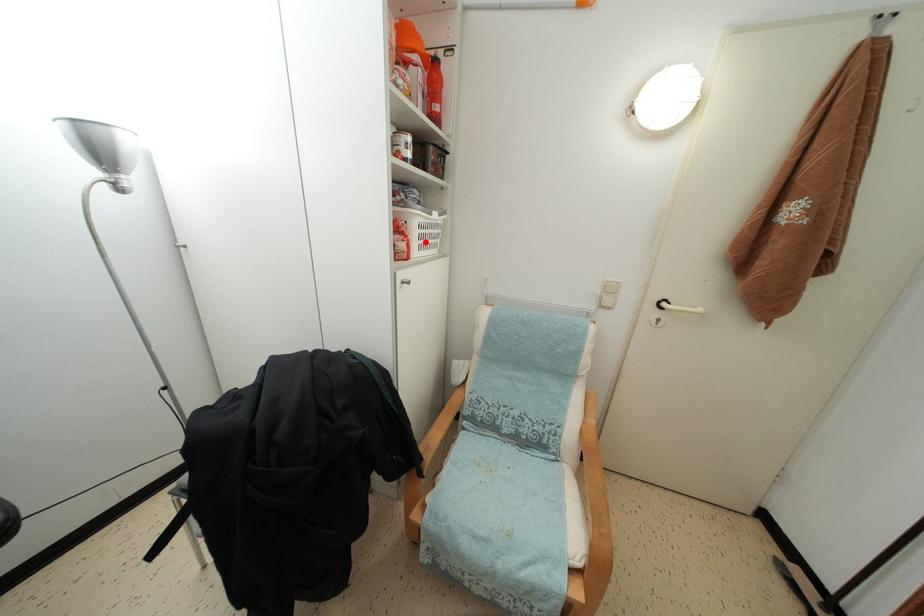
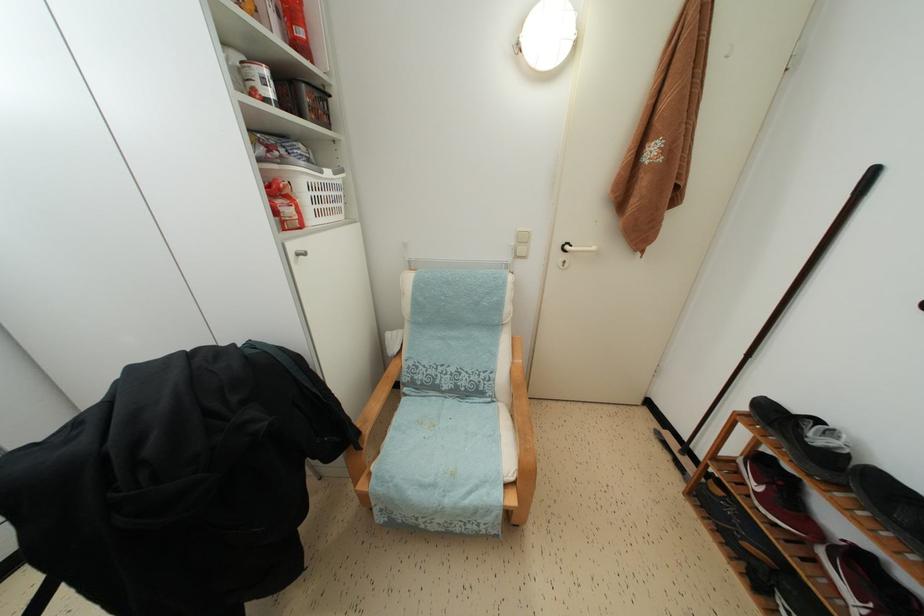
Locate, in the second image, the point that corresponds to the highlighted location in the first image.

(319, 206)